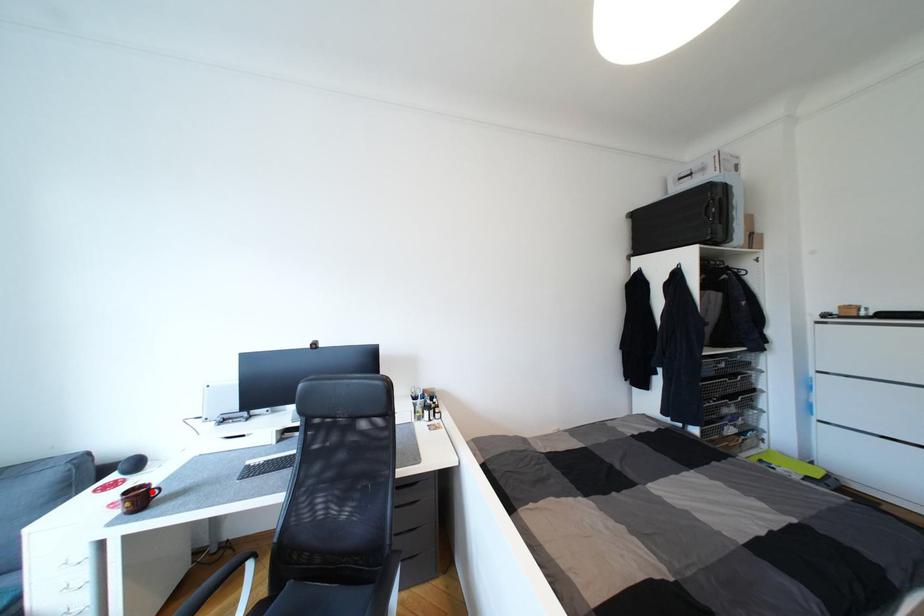
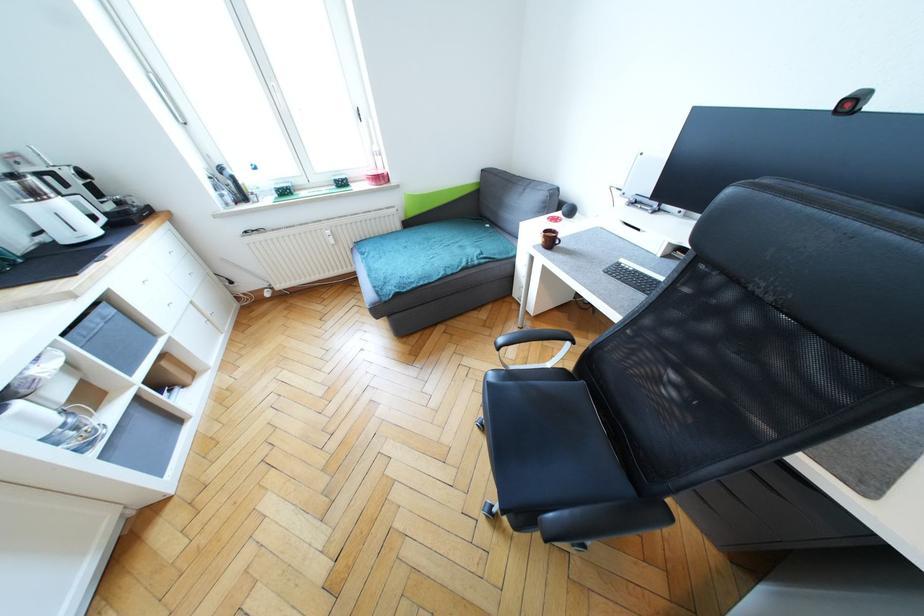
The point at the highlighted location is marked in the first image. Where is the corresponding point in the second image?

(558, 238)